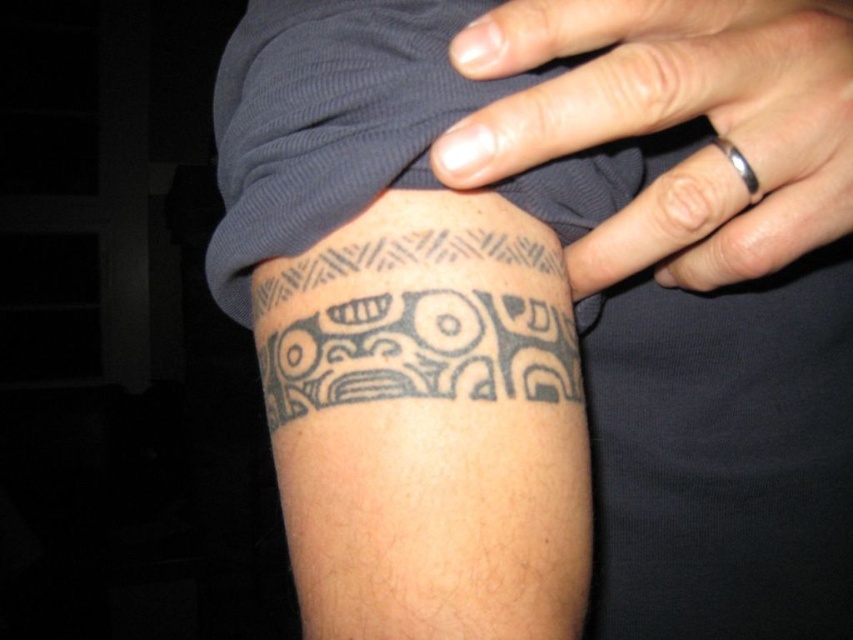
This screenshot has width=853, height=640. Identify the location of black matte ring at upper center. (674, 124).

Which of these two, black matte ring at upper center or black ink tattoo at lower center, stands shorter?

Standing shorter between the two is black ink tattoo at lower center.

Who is more distant from viewer, (839, 40) or (529, 385)?

The point (529, 385) is more distant.

In order to click on black matte ring at upper center in this screenshot , I will do `click(674, 124)`.